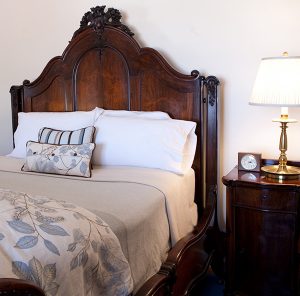
The height and width of the screenshot is (296, 300). What are the coordinates of `pillow` in the screenshot? It's located at (59, 162).